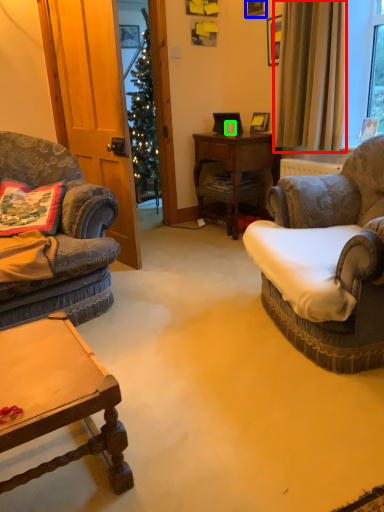
Question: Estimate the real-world distances between objects in this image. Which object is farther from curtain (highlighted by a red box), picture frame (highlighted by a blue box) or coffee cup (highlighted by a green box)?

Choices:
 (A) picture frame
 (B) coffee cup

Answer: (A)